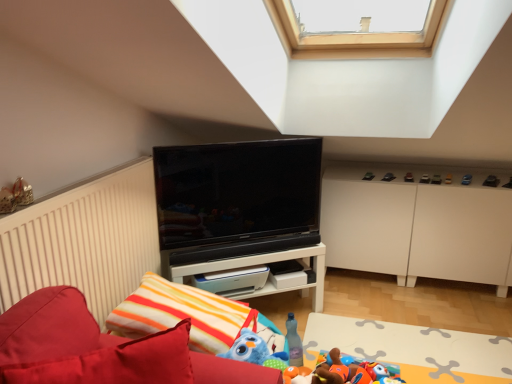
Identify the location of free space between blue plastic toy at upper right, which ranks as the 4th toy in front-to-back order, and metallic black toy car at upper right, the third toy positioned from the front. The image size is (512, 384). (478, 179).